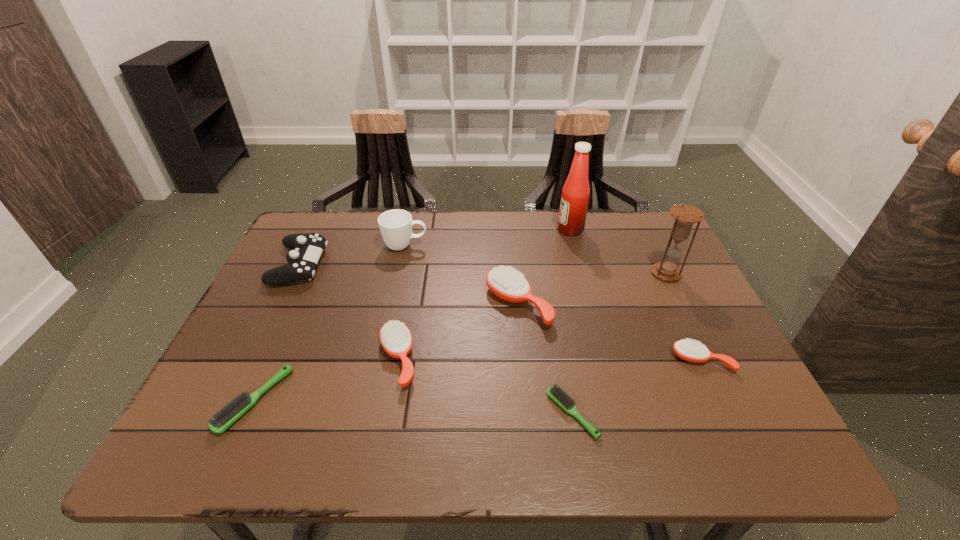
Find the location of a particular element. This screenshot has height=540, width=960. control located at the left edge is located at coordinates (302, 260).

Find the location of a particular element. The height and width of the screenshot is (540, 960). hairbrush that is at the left edge is located at coordinates (229, 414).

Find the location of `hourglass located in the right edge section of the desktop`. hourglass located in the right edge section of the desktop is located at coordinates (685, 216).

You are a GUI agent. You are given a task and a screenshot of the screen. Output one action in this format:
    pyautogui.click(x=<x>, y=<y>)
    Task: Click on the hairbrush located in the right edge section of the desktop
    The width and height of the screenshot is (960, 540).
    Given the screenshot: What is the action you would take?
    pyautogui.click(x=693, y=351)

Locate an element on the screen. The width and height of the screenshot is (960, 540). object that is positioned at the far left corner is located at coordinates (302, 260).

At what (x,y) coordinates should I click in order to perform the action: click on object that is at the near left corner. Please return your answer as a coordinate pair (x, y). Looking at the image, I should click on (229, 414).

Identify the location of vacant space at the far edge. (426, 214).

You are a GUI agent. You are given a task and a screenshot of the screen. Output one action in this format:
    pyautogui.click(x=<x>, y=<y>)
    Task: Click on the vacant space at the near edge of the desktop
    
    Given the screenshot: What is the action you would take?
    pyautogui.click(x=580, y=426)

In the image, there is a desktop. Identify the location of vacant space at the right edge. This screenshot has height=540, width=960. (673, 341).

Find the location of a particular element. The height and width of the screenshot is (540, 960). free point at the far left corner is located at coordinates (343, 212).